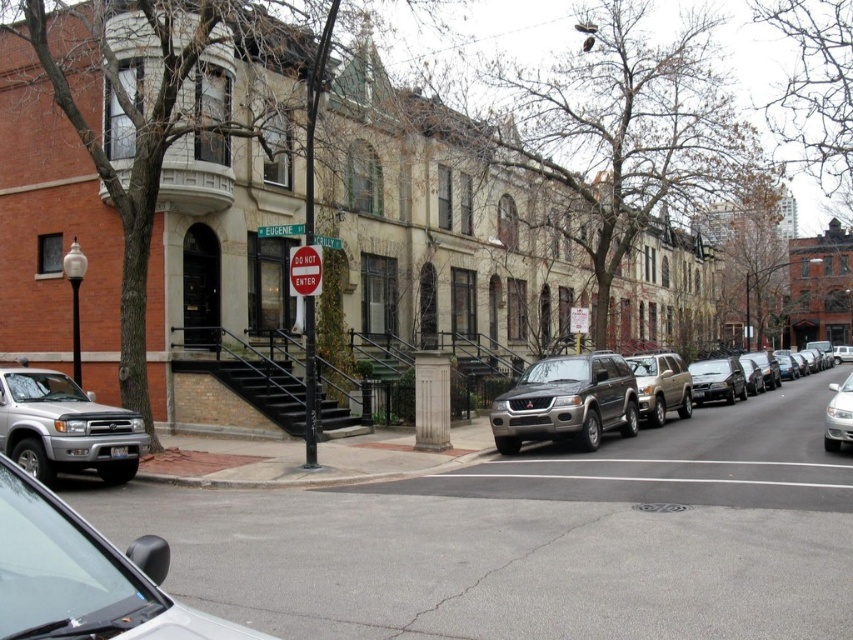
You are a delivery person trying to park your 1.8 meters tall delivery box in the space between the silver metallic sedan at lower left and the satin silver suv at center. Can the delivery box fit vertically between them?

The silver metallic sedan at lower left is shorter than the satin silver suv at center. Since the delivery box is 1.8 meters tall, it can fit vertically between them as long as the space between the two vehicles is at least 1.8 meters wide.

You are a delivery driver and need to park your vehicle which is 1.8 meters wide. You see a satin gold suv at center and a white glossy sedan at right. Which parking spot between them can accommodate your vehicle?

The satin gold suv at center has a width less than the white glossy sedan at right, so the parking spot between them can accommodate your vehicle if the available space is at least 1.8 meters. However, since the SUV is narrower, the space next to it might be more suitable.

You are a delivery driver who needs to park your vehicle in this area. The parking spot you want to use is located at coordinates 0.603, 0.776. Is your vehicle, the satin gold suv at center, currently occupying that spot?

Yes, the satin gold suv at center is positioned at point (660, 385), so it is occupying the parking spot you want to use.